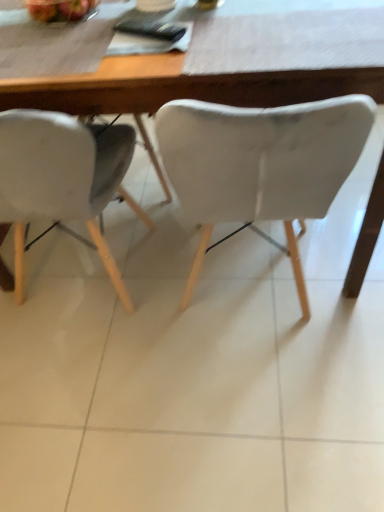
Question: Can you confirm if white matte chair at center, the first chair viewed from the right, is smaller than shiny red apple at upper left?

Choices:
 (A) yes
 (B) no

Answer: (B)

Question: Is white matte chair at center, the second chair when ordered from left to right, bigger than shiny red apple at upper left?

Choices:
 (A) no
 (B) yes

Answer: (B)

Question: Does white matte chair at center, the second chair when ordered from left to right, have a greater width compared to shiny red apple at upper left?

Choices:
 (A) yes
 (B) no

Answer: (A)

Question: Is white matte chair at center, the second chair when ordered from left to right, oriented away from shiny red apple at upper left?

Choices:
 (A) yes
 (B) no

Answer: (B)

Question: Is white matte chair at center, the second chair when ordered from left to right, outside of shiny red apple at upper left?

Choices:
 (A) yes
 (B) no

Answer: (A)

Question: Could you tell me if white matte chair at center, the first chair viewed from the right, is turned towards shiny red apple at upper left?

Choices:
 (A) yes
 (B) no

Answer: (B)

Question: Does wooden table at center have a smaller size compared to shiny red apple at upper left?

Choices:
 (A) yes
 (B) no

Answer: (B)

Question: Is wooden table at center looking in the opposite direction of shiny red apple at upper left?

Choices:
 (A) no
 (B) yes

Answer: (A)

Question: Would you say wooden table at center is a long distance from shiny red apple at upper left?

Choices:
 (A) yes
 (B) no

Answer: (B)

Question: Does wooden table at center come behind shiny red apple at upper left?

Choices:
 (A) yes
 (B) no

Answer: (B)

Question: Is wooden table at center beside shiny red apple at upper left?

Choices:
 (A) no
 (B) yes

Answer: (A)

Question: Is wooden table at center completely or partially outside of shiny red apple at upper left?

Choices:
 (A) yes
 (B) no

Answer: (A)

Question: Does white matte chair at left, marked as the 1th chair in a left-to-right arrangement, have a lesser height compared to wooden table at center?

Choices:
 (A) no
 (B) yes

Answer: (A)